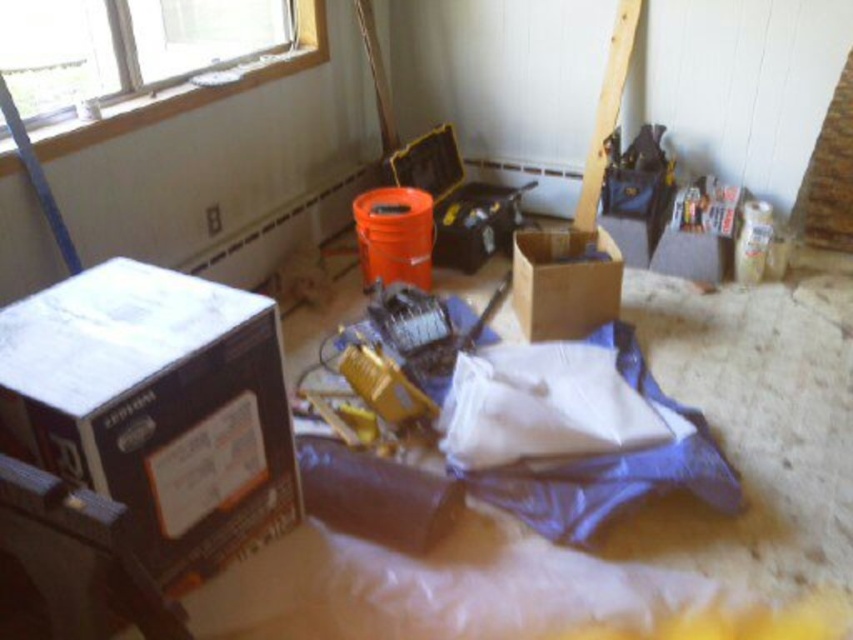
You are a contractor working in this room and need to move a ladder from the brown cardboard box at center to the white painted wood window at upper left. The ladder is 4 feet long. Can you move it horizontally without tilting it?

The distance between the brown cardboard box at center and the white painted wood window at upper left is 4.47 feet. Since the ladder is only 4 feet long, it can be moved horizontally as the space is sufficient.